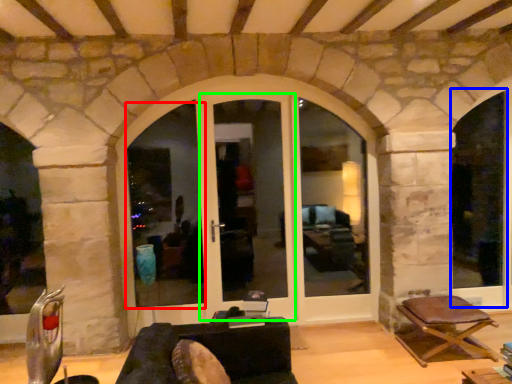
Question: Which object is the farthest from window frame (highlighted by a red box)? Choose among these: window frame (highlighted by a blue box) or screen door (highlighted by a green box).

Choices:
 (A) window frame
 (B) screen door

Answer: (A)